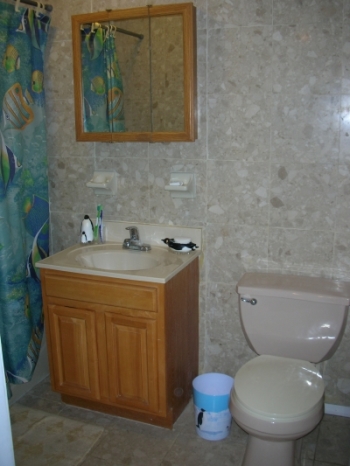
This screenshot has width=350, height=466. I want to click on shower curtain, so point(21,312).